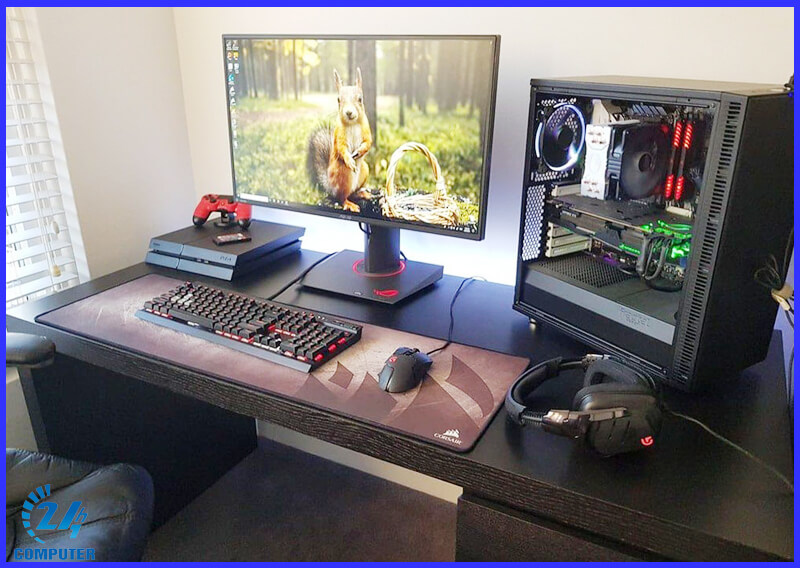
Identify the location of keyboard. The height and width of the screenshot is (568, 800). (252, 321).